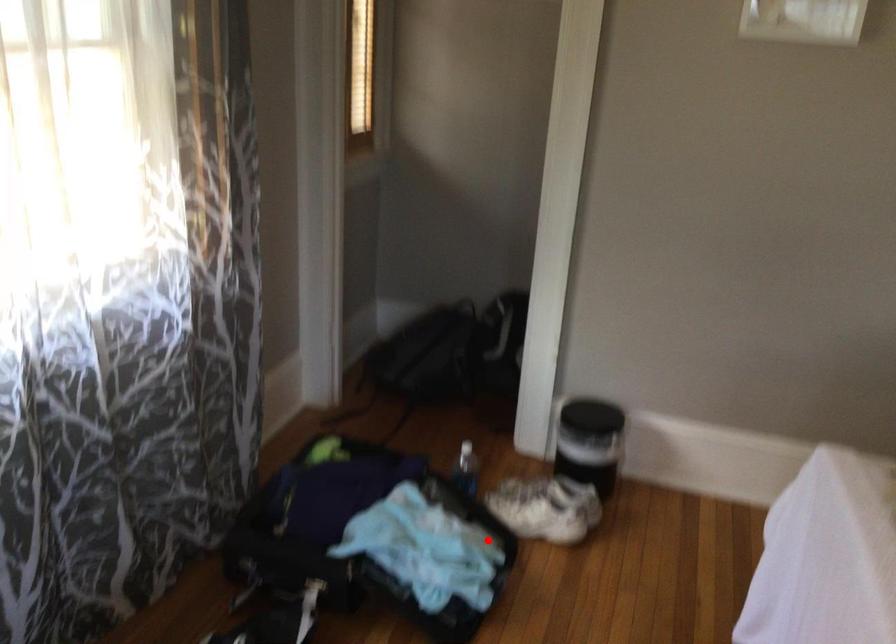
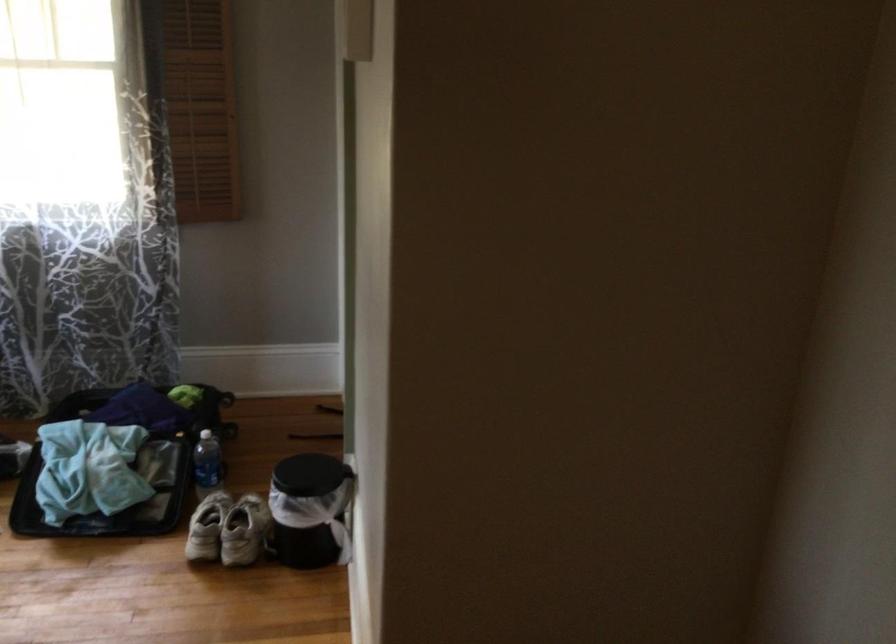
Where in the second image is the point corresponding to the highlighted location from the first image?

(110, 491)